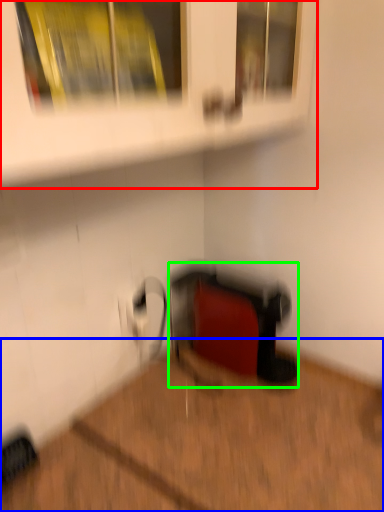
Question: Which object is positioned farthest from shelf (highlighted by a red box)? Select from hardwood (highlighted by a blue box) and wide (highlighted by a green box).

Choices:
 (A) hardwood
 (B) wide

Answer: (A)